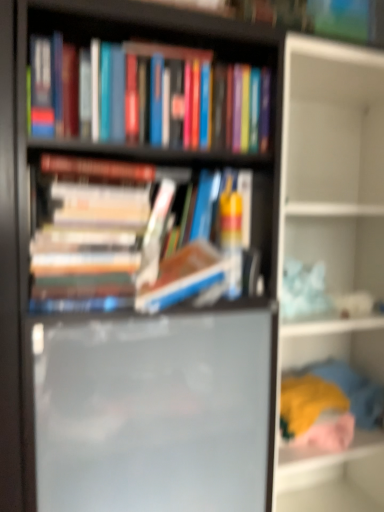
Question: Considering the positions of matte black bookshelf at center and soft fabric clothes at lower right, the second shelf in the top-to-bottom sequence, in the image, is matte black bookshelf at center bigger or smaller than soft fabric clothes at lower right, the second shelf in the top-to-bottom sequence,?

Choices:
 (A) small
 (B) big

Answer: (B)

Question: From a real-world perspective, is matte black bookshelf at center physically located above or below soft fabric clothes at lower right, the second shelf in the top-to-bottom sequence?

Choices:
 (A) above
 (B) below

Answer: (A)

Question: Based on their relative distances, which object is nearer to the white matte shelf at upper right, which is the 2th shelf in bottom-to-top order?

Choices:
 (A) hardcover books at upper center, which appears as the second book when ordered from the bottom
 (B) hardcover books at center, which appears as the first book when ordered from the bottom
 (C) soft fabric clothes at lower right, the second shelf in the top-to-bottom sequence
 (D) matte black bookshelf at center

Answer: (C)

Question: Estimate the real-world distances between objects in this image. Which object is closer to the white matte shelf at upper right, which is the 2th shelf in bottom-to-top order?

Choices:
 (A) matte black bookshelf at center
 (B) soft fabric clothes at lower right, the first shelf ordered from the bottom
 (C) hardcover books at center, positioned as the second book in top-to-bottom order
 (D) hardcover books at upper center, the 1th book from the top

Answer: (B)